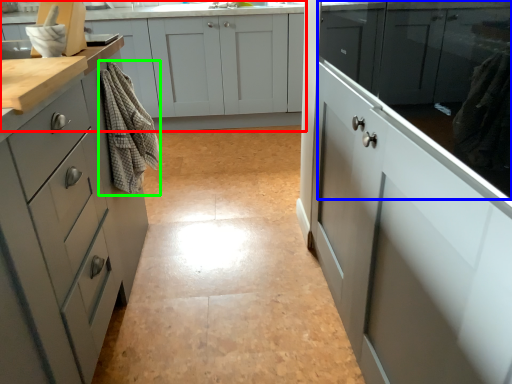
Question: Based on their relative distances, which object is nearer to cabinetry (highlighted by a red box)? Choose from cabinetry (highlighted by a blue box) and material (highlighted by a green box).

Choices:
 (A) cabinetry
 (B) material

Answer: (B)